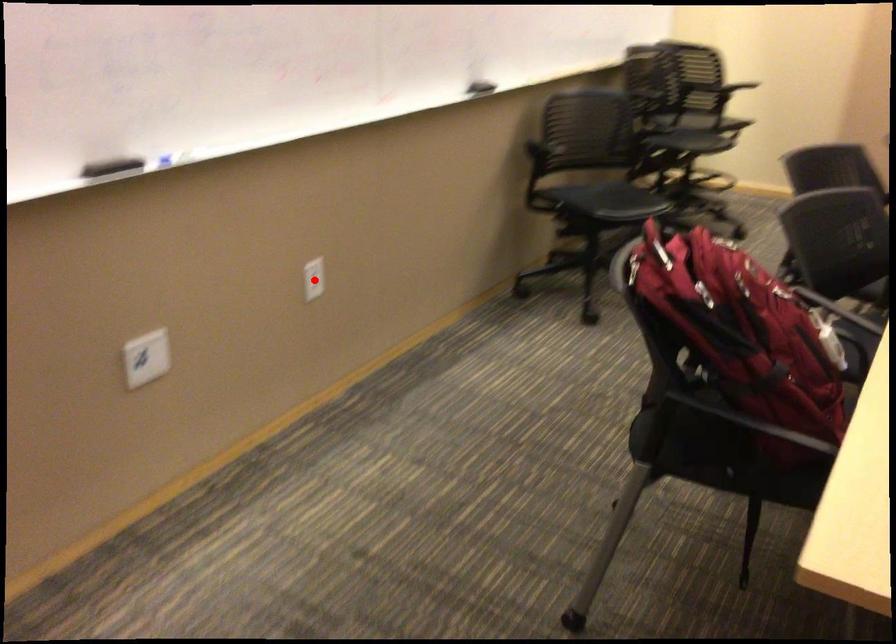
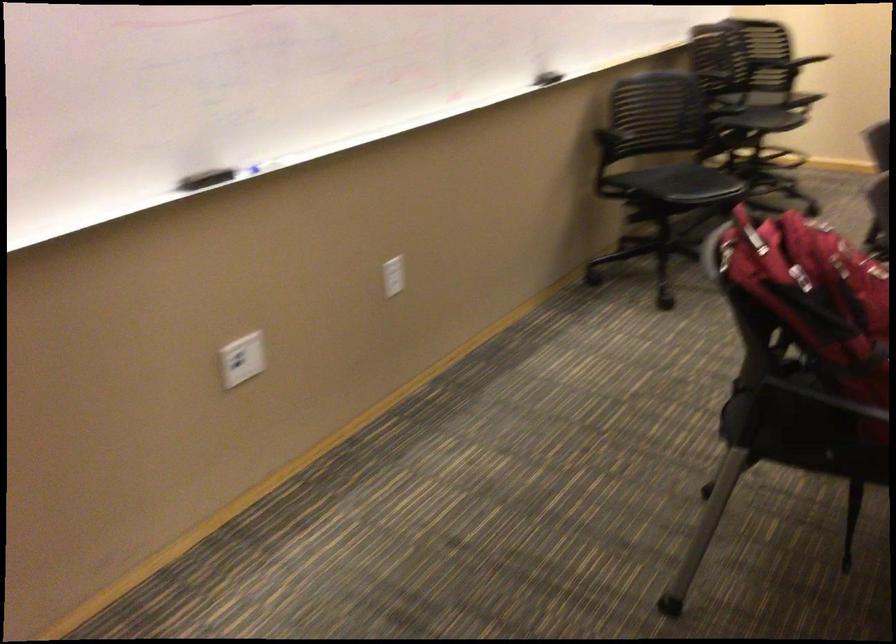
Find the pixel in the second image that matches the highlighted location in the first image.

(392, 276)